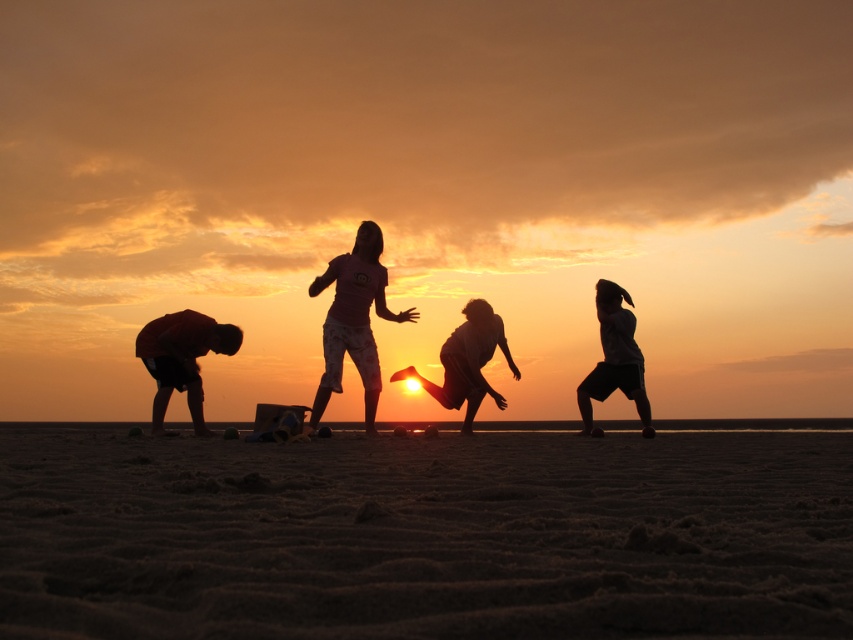
Consider the image. Can you confirm if brown sandy beach at lower center is thinner than dark red fabric shorts at lower left?

Correct, brown sandy beach at lower center's width is less than dark red fabric shorts at lower left's.

Can you confirm if brown sandy beach at lower center is bigger than dark red fabric shorts at lower left?

No.

Based on the photo, who is more distant from viewer, (x=515, y=589) or (x=202, y=336)?

Point (x=202, y=336)

Locate an element on the screen. brown sandy beach at lower center is located at coordinates (424, 536).

From the picture: Which of these two, pink fabric shorts at center or silhouette child at center, stands taller?

pink fabric shorts at center

Who is shorter, pink fabric shorts at center or silhouette child at center?

Standing shorter between the two is silhouette child at center.

Identify the location of pink fabric shorts at center. (354, 320).

Can you confirm if dark red fabric shorts at lower left is thinner than silhouette figure at right?

Incorrect, dark red fabric shorts at lower left's width is not less than silhouette figure at right's.

How much distance is there between dark red fabric shorts at lower left and silhouette figure at right?

dark red fabric shorts at lower left is 3.86 meters away from silhouette figure at right.

Is point (170, 371) closer to viewer compared to point (601, 326)?

Yes, it is.

Locate an element on the screen. dark red fabric shorts at lower left is located at coordinates (183, 358).